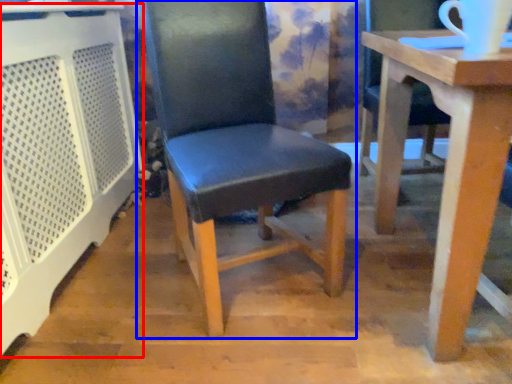
Question: Which of the following is the farthest to the observer, cage (highlighted by a red box) or chair (highlighted by a blue box)?

Choices:
 (A) cage
 (B) chair

Answer: (B)